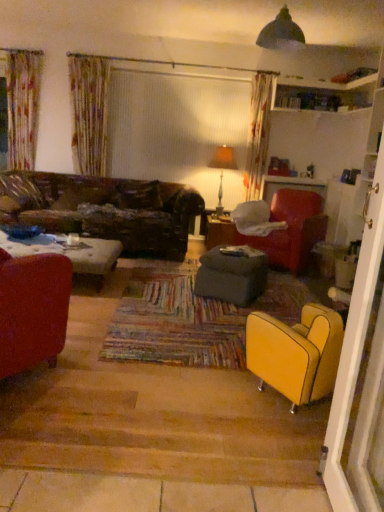
Measure the distance between point (252, 339) and camera.

The distance of point (252, 339) from camera is 2.21 meters.

You are a GUI agent. You are given a task and a screenshot of the screen. Output one action in this format:
    pyautogui.click(x=<x>, y=<y>)
    Task: Click on the velvet red armchair at center-right, which is the first chair from right to left
    The width and height of the screenshot is (384, 512).
    Given the screenshot: What is the action you would take?
    pyautogui.click(x=291, y=230)

Identify the location of matte brown table at center. (219, 231).

This screenshot has width=384, height=512. What do you see at coordinates (219, 231) in the screenshot?
I see `matte brown table at center` at bounding box center [219, 231].

Locate an element on the screen. The width and height of the screenshot is (384, 512). yellow leather armchair at lower right, which appears as the second chair when viewed from the front is located at coordinates (296, 353).

Is point (303, 210) positioned behind point (209, 222)?

No, it is not.

In the scene shown: Is matte brown table at center at the back of velvet red armchair at center-right, the third chair in the left-to-right sequence?

No, matte brown table at center is not at the back of velvet red armchair at center-right, the third chair in the left-to-right sequence.

Based on their positions, is velvet red armchair at center-right, which appears as the 1th chair when viewed from the back, located to the left or right of matte brown table at center?

Clearly, velvet red armchair at center-right, which appears as the 1th chair when viewed from the back, is on the right of matte brown table at center in the image.

Is velvet red armchair at center-right, which appears as the 1th chair when viewed from the back, positioned with its back to matte orange lampshade at upper center?

No, matte orange lampshade at upper center is not at the back of velvet red armchair at center-right, which appears as the 1th chair when viewed from the back.

Considering the sizes of objects velvet red armchair at center-right, which appears as the 1th chair when viewed from the back, and matte orange lampshade at upper center in the image provided, who is bigger, velvet red armchair at center-right, which appears as the 1th chair when viewed from the back, or matte orange lampshade at upper center?

With larger size is velvet red armchair at center-right, which appears as the 1th chair when viewed from the back.

Where is `chair that is the 1st object directly below the matte orange lampshade at upper center (from a real-world perspective)`? Image resolution: width=384 pixels, height=512 pixels. chair that is the 1st object directly below the matte orange lampshade at upper center (from a real-world perspective) is located at coordinates (291, 230).

Is velvet red armchair at center-right, which is the first chair from right to left, inside or outside of matte orange lampshade at upper center?

The correct answer is: outside.

From the image's perspective, count 2nd chairs downward from the matte orange lampshade at upper center and point to it. Please provide its 2D coordinates.

[(32, 310)]

From the image's perspective, is matte orange lampshade at upper center under matte red armchair at left, placed as the third chair when sorted from right to left?

No, from the image's perspective, matte orange lampshade at upper center is not beneath matte red armchair at left, placed as the third chair when sorted from right to left.

Which object is further away from the camera taking this photo, matte orange lampshade at upper center or matte red armchair at left, positioned as the first chair in front-to-back order?

matte orange lampshade at upper center.

Is matte orange lampshade at upper center positioned with its back to matte red armchair at left, the third chair from the back?

No.

Based on the photo, which is behind, velvet red armchair at center-right, which appears as the 1th chair when viewed from the back, or matte red armchair at left, the first chair when ordered from left to right?

velvet red armchair at center-right, which appears as the 1th chair when viewed from the back, is further from the camera.

Does point (300, 269) come in front of point (54, 310)?

No, it is behind (54, 310).

Considering the sizes of objects velvet red armchair at center-right, the third chair in the left-to-right sequence, and matte red armchair at left, the third chair from the back, in the image provided, who is thinner, velvet red armchair at center-right, the third chair in the left-to-right sequence, or matte red armchair at left, the third chair from the back,?

matte red armchair at left, the third chair from the back, is thinner.

Is velvet red armchair at center-right, which is the first chair from right to left, situated inside matte red armchair at left, placed as the third chair when sorted from right to left, or outside?

velvet red armchair at center-right, which is the first chair from right to left, is located beyond the bounds of matte red armchair at left, placed as the third chair when sorted from right to left.

Looking at this image, how far apart are yellow leather armchair at lower right, which appears as the second chair when viewed from the front, and matte orange lampshade at upper center?

4.41 meters.

Which object is wider, yellow leather armchair at lower right, the 2th chair from the right, or matte orange lampshade at upper center?

Wider between the two is yellow leather armchair at lower right, the 2th chair from the right.

This screenshot has height=512, width=384. What are the coordinates of `chair that is the 1st one when counting rightward from the matte orange lampshade at upper center` in the screenshot? It's located at (296, 353).

Is yellow leather armchair at lower right, which is the second chair in back-to-front order, facing towards matte orange lampshade at upper center?

No, yellow leather armchair at lower right, which is the second chair in back-to-front order, is not turned towards matte orange lampshade at upper center.

From the picture: Based on their positions, is dark gray fabric ottoman at center located to the left or right of yellow leather armchair at lower right, the 2th chair from the right?

dark gray fabric ottoman at center is to the left of yellow leather armchair at lower right, the 2th chair from the right.

Does dark gray fabric ottoman at center have a greater width compared to yellow leather armchair at lower right, which is the second chair in back-to-front order?

Yes.

Is there a large distance between dark gray fabric ottoman at center and yellow leather armchair at lower right, which is the second chair in back-to-front order?

Yes, dark gray fabric ottoman at center and yellow leather armchair at lower right, which is the second chair in back-to-front order, are quite far apart.

Is matte brown table at center positioned with its back to velvet red armchair at center-right, which is the first chair from right to left?

No, velvet red armchair at center-right, which is the first chair from right to left, is not at the back of matte brown table at center.

Considering the sizes of matte brown table at center and velvet red armchair at center-right, which appears as the 1th chair when viewed from the back, in the image, is matte brown table at center bigger or smaller than velvet red armchair at center-right, which appears as the 1th chair when viewed from the back,?

In the image, matte brown table at center appears to be smaller than velvet red armchair at center-right, which appears as the 1th chair when viewed from the back.

Is matte brown table at center not close to velvet red armchair at center-right, which is the third chair from front to back?

No.

In order to click on table on the left of velvet red armchair at center-right, which is the first chair from right to left in this screenshot , I will do `click(219, 231)`.

In order to click on table behind the velvet red armchair at center-right, which is the third chair from front to back in this screenshot , I will do `click(219, 231)`.

In order to click on lamp that appears above the velvet red armchair at center-right, which is the first chair from right to left (from a real-world perspective) in this screenshot , I will do `click(222, 168)`.

Looking at the image, which one is located further to matte red armchair at left, the first chair when ordered from left to right, yellow leather armchair at lower right, which is the 2th chair in left-to-right order, or matte orange lampshade at upper center?

The object further to matte red armchair at left, the first chair when ordered from left to right, is matte orange lampshade at upper center.

When comparing their distances from yellow leather armchair at lower right, which appears as the second chair when viewed from the front, does matte brown table at center or matte orange lampshade at upper center seem closer?

The object closer to yellow leather armchair at lower right, which appears as the second chair when viewed from the front, is matte brown table at center.

Estimate the real-world distances between objects in this image. Which object is further from matte orange lampshade at upper center, matte red armchair at left, positioned as the first chair in front-to-back order, or yellow leather armchair at lower right, which appears as the second chair when viewed from the front?

matte red armchair at left, positioned as the first chair in front-to-back order, lies further to matte orange lampshade at upper center than the other object.

Which object lies further to the anchor point dark gray fabric ottoman at center, velvet red armchair at center-right, which is the third chair from front to back, or matte red armchair at left, the third chair from the back?

Among the two, matte red armchair at left, the third chair from the back, is located further to dark gray fabric ottoman at center.

Based on their spatial positions, is matte red armchair at left, positioned as the first chair in front-to-back order, or matte orange lampshade at upper center further from yellow leather armchair at lower right, which is the second chair in back-to-front order?

matte orange lampshade at upper center is further to yellow leather armchair at lower right, which is the second chair in back-to-front order.

When comparing their distances from matte orange lampshade at upper center, does matte red armchair at left, placed as the third chair when sorted from right to left, or dark gray fabric ottoman at center seem further?

Based on the image, matte red armchair at left, placed as the third chair when sorted from right to left, appears to be further to matte orange lampshade at upper center.

Considering their positions, is yellow leather armchair at lower right, the 2th chair from the right, positioned further to velvet red armchair at center-right, which is the third chair from front to back, than matte orange lampshade at upper center?

yellow leather armchair at lower right, the 2th chair from the right.

Considering their positions, is matte red armchair at left, positioned as the first chair in front-to-back order, positioned closer to dark gray fabric ottoman at center than velvet red armchair at center-right, which is the third chair from front to back?

Among the two, velvet red armchair at center-right, which is the third chair from front to back, is located nearer to dark gray fabric ottoman at center.

Locate an element on the screen. footrest between yellow leather armchair at lower right, which is the second chair in back-to-front order, and matte brown table at center from front to back is located at coordinates (230, 277).

This screenshot has height=512, width=384. Identify the location of chair between yellow leather armchair at lower right, which is the second chair in back-to-front order, and matte orange lampshade at upper center from front to back. (291, 230).

Identify the location of chair between yellow leather armchair at lower right, which appears as the second chair when viewed from the front, and matte brown table at center from front to back. The width and height of the screenshot is (384, 512). (291, 230).

Locate an element on the screen. This screenshot has width=384, height=512. footrest between matte red armchair at left, positioned as the first chair in front-to-back order, and matte orange lampshade at upper center in the front-back direction is located at coordinates (230, 277).